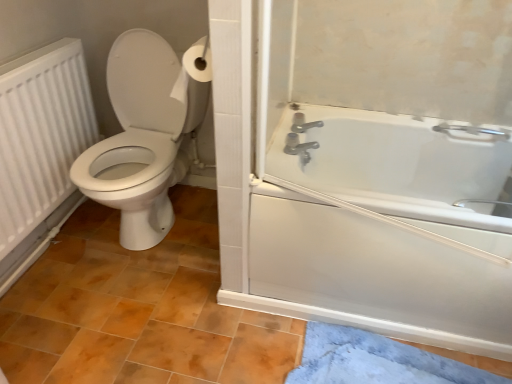
Question: In terms of size, does blue plush bath mat at lower right appear bigger or smaller than brown matte tile at lower center?

Choices:
 (A) small
 (B) big

Answer: (A)

Question: Choose the correct answer: Is blue plush bath mat at lower right inside brown matte tile at lower center or outside it?

Choices:
 (A) inside
 (B) outside

Answer: (A)

Question: Which of these objects is positioned closest to the brown matte tile at lower center?

Choices:
 (A) white plastic bathtub at right
 (B) white glossy toilet at left
 (C) blue plush bath mat at lower right
 (D) white matte radiator at left

Answer: (B)

Question: Which object is positioned farthest from the white plastic bathtub at right?

Choices:
 (A) blue plush bath mat at lower right
 (B) white matte radiator at left
 (C) brown matte tile at lower center
 (D) white glossy toilet at left

Answer: (B)